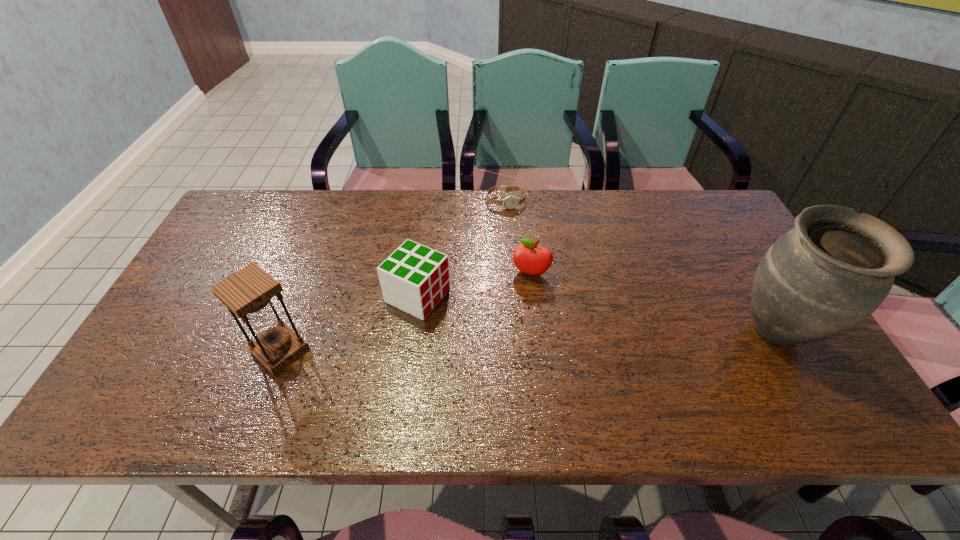
Where is `hourglass positioned at the near edge`? The width and height of the screenshot is (960, 540). hourglass positioned at the near edge is located at coordinates (247, 293).

This screenshot has width=960, height=540. I want to click on urn that is at the near edge, so [830, 272].

Where is `object at the right edge`? object at the right edge is located at coordinates (830, 272).

Locate an element on the screen. object at the near right corner is located at coordinates (830, 272).

In the image, there is a desktop. Where is `vacant space at the far edge`? The image size is (960, 540). vacant space at the far edge is located at coordinates (667, 226).

Locate an element on the screen. The width and height of the screenshot is (960, 540). vacant space at the near edge of the desktop is located at coordinates (407, 363).

At what (x,y) coordinates should I click in order to perform the action: click on free space at the left edge of the desktop. Please return your answer as a coordinate pair (x, y). Looking at the image, I should click on (240, 265).

Find the location of a particular element. free location at the right edge is located at coordinates (785, 353).

The width and height of the screenshot is (960, 540). Find the location of `free location at the far left corner of the desktop`. free location at the far left corner of the desktop is located at coordinates (250, 215).

Find the location of `free space at the near left corner of the desktop`. free space at the near left corner of the desktop is located at coordinates (182, 374).